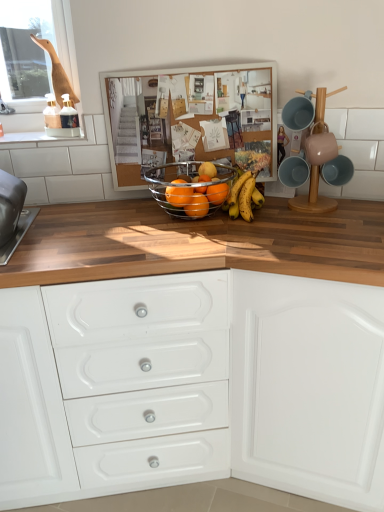
This screenshot has height=512, width=384. I want to click on vacant area to the right of matte blue cup at upper right, so click(364, 209).